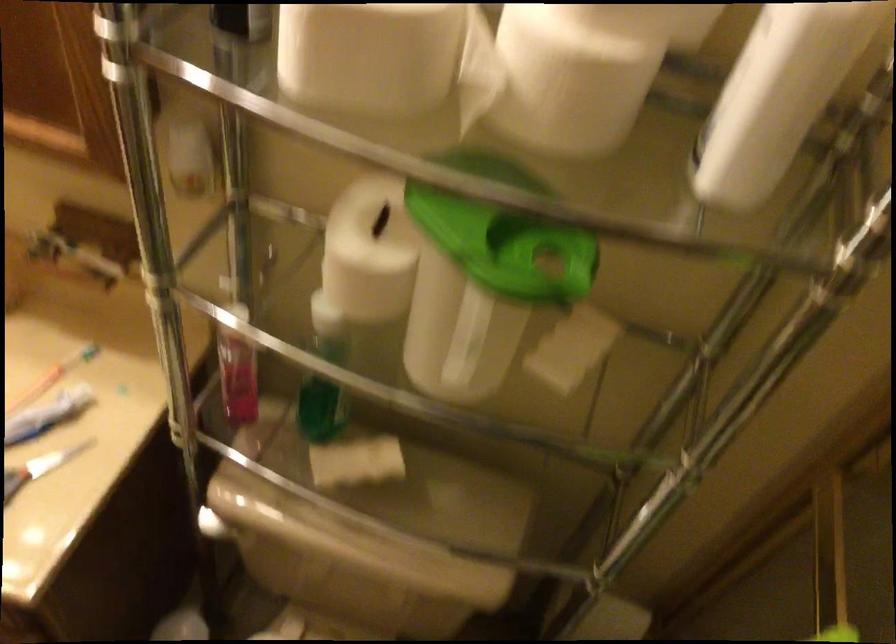
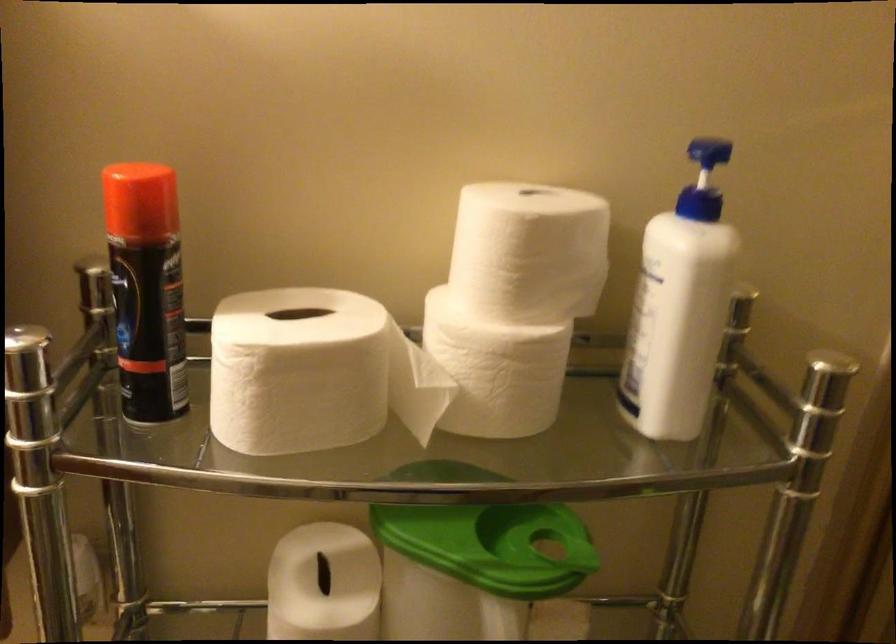
First-person continuous shooting, in which direction is the camera rotating?

The camera's rotation is toward right-up.